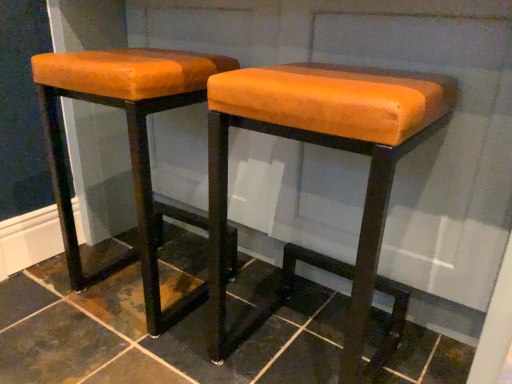
Question: Is dark brown tile at center taller or shorter than orange leather stool at left, placed as the second stool when sorted from right to left?

Choices:
 (A) short
 (B) tall

Answer: (A)

Question: Considering the relative positions of dark brown tile at center and orange leather stool at left, which is counted as the first stool, starting from the left, in the image provided, is dark brown tile at center to the left or to the right of orange leather stool at left, which is counted as the first stool, starting from the left,?

Choices:
 (A) left
 (B) right

Answer: (B)

Question: Which object is the farthest from the orange leather stool at center, positioned as the 2th stool in left-to-right order?

Choices:
 (A) dark brown tile at center
 (B) orange leather stool at left, placed as the second stool when sorted from right to left

Answer: (A)

Question: Considering the real-world distances, which object is farthest from the orange leather stool at left, placed as the second stool when sorted from right to left?

Choices:
 (A) orange leather stool at center, the first stool in the right-to-left sequence
 (B) dark brown tile at center

Answer: (A)